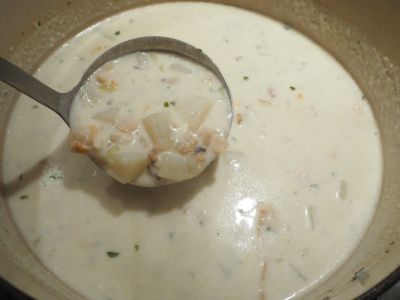
At what (x,y) coordinates should I click in order to perform the action: click on bowl portion of soup ladle. Please return your answer as a coordinate pair (x, y). The image size is (400, 300). Looking at the image, I should click on point(183,48).